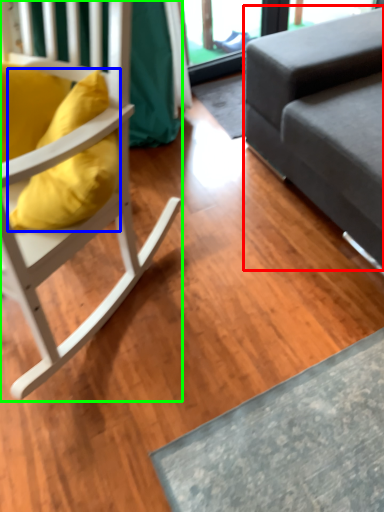
Question: Based on their relative distances, which object is farther from studio couch (highlighted by a red box)? Choose from pillow (highlighted by a blue box) and chair (highlighted by a green box).

Choices:
 (A) pillow
 (B) chair

Answer: (A)